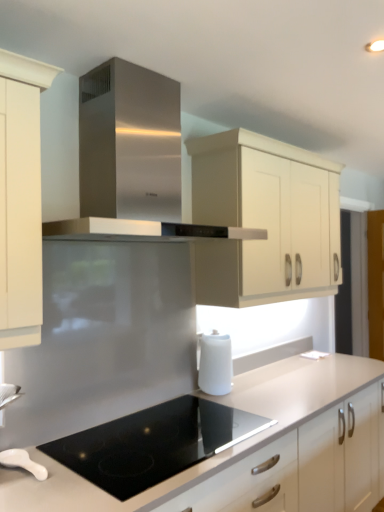
Question: Is white matte kettle at lower center, which is the second kitchen appliance from left to right, to the left or to the right of stainless steel range hood at center in the image?

Choices:
 (A) left
 (B) right

Answer: (B)

Question: In the image, is white matte kettle at lower center, the second kitchen appliance positioned from the front, positioned in front of or behind stainless steel range hood at center?

Choices:
 (A) behind
 (B) front

Answer: (A)

Question: Estimate the real-world distances between objects in this image. Which object is farther from the stainless steel range hood at center?

Choices:
 (A) black glass cooktop at center
 (B) cream matte cabinet at upper center
 (C) white matte countertop at center
 (D) white glossy spoon at lower left, arranged as the first kitchen appliance when viewed from the left
 (E) white matte kettle at lower center, positioned as the 1th kitchen appliance in right-to-left order

Answer: (C)

Question: Estimate the real-world distances between objects in this image. Which object is farther from the black glass cooktop at center?

Choices:
 (A) white matte kettle at lower center, the first kitchen appliance viewed from the back
 (B) white matte countertop at center
 (C) white glossy spoon at lower left, the second kitchen appliance from the back
 (D) cream matte cabinet at upper center
 (E) stainless steel range hood at center

Answer: (E)